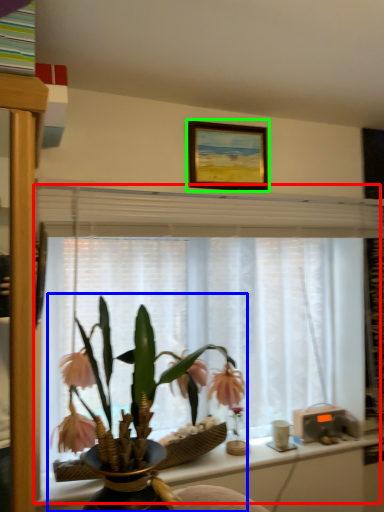
Question: Based on their relative distances, which object is farther from window frame (highlighted by a red box)? Choose from houseplant (highlighted by a blue box) and picture frame (highlighted by a green box).

Choices:
 (A) houseplant
 (B) picture frame

Answer: (B)